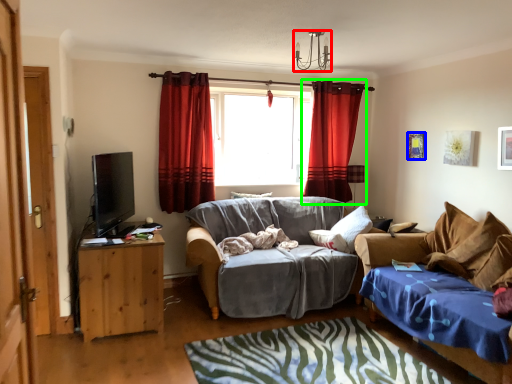
Question: Which is nearer to the lamp (highlighted by a red box)? picture frame (highlighted by a blue box) or curtain (highlighted by a green box).

Choices:
 (A) picture frame
 (B) curtain

Answer: (B)